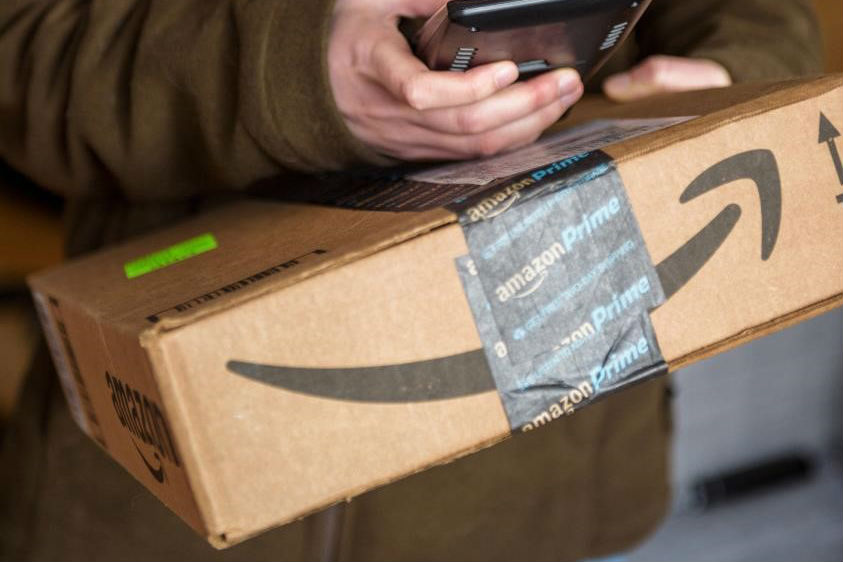
Find the location of a particular element. grey floor is located at coordinates (693, 550), (771, 516), (836, 498), (835, 548).